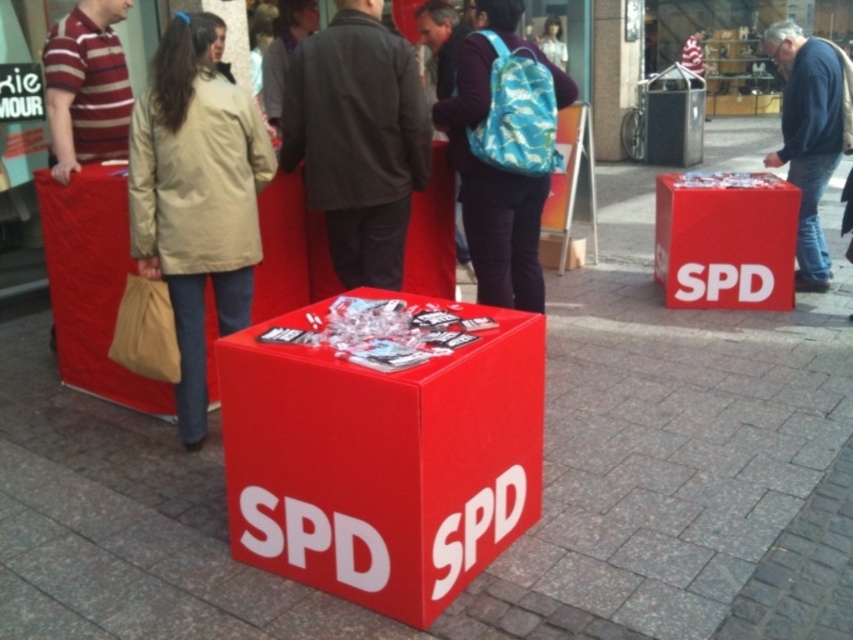
Question: Observing the image, what is the correct spatial positioning of dark gray jacket at center in reference to matte blue backpack at center?

Choices:
 (A) below
 (B) above

Answer: (A)

Question: Which object is positioned closest to the camo-patterned backpack at center?

Choices:
 (A) blue denim jeans at lower right
 (B) beige fabric coat at center

Answer: (B)

Question: Which of the following is the closest to the observer?

Choices:
 (A) matte cardboard box at center
 (B) red matte cube at center

Answer: (B)

Question: Is the position of beige fabric coat at center more distant than that of camo-patterned backpack at center?

Choices:
 (A) no
 (B) yes

Answer: (A)

Question: Estimate the real-world distances between objects in this image. Which object is farther from the striped cotton shirt at left?

Choices:
 (A) blue denim jeans at lower right
 (B) camo-patterned backpack at center
 (C) matte cardboard box at center
 (D) dark gray jacket at center

Answer: (A)

Question: In this image, where is dark gray jacket at center located relative to striped cotton shirt at left?

Choices:
 (A) below
 (B) above

Answer: (A)